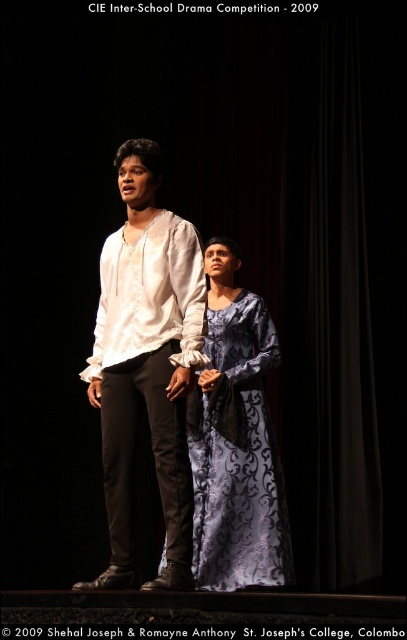
This screenshot has height=640, width=407. Describe the element at coordinates (146, 364) in the screenshot. I see `matte white shirt at center` at that location.

Based on the photo, does matte white shirt at center appear under silvery blue dress at center?

Actually, matte white shirt at center is above silvery blue dress at center.

Does point (155, 307) come farther from viewer compared to point (249, 467)?

No, (155, 307) is in front of (249, 467).

This screenshot has width=407, height=640. I want to click on matte white shirt at center, so click(146, 364).